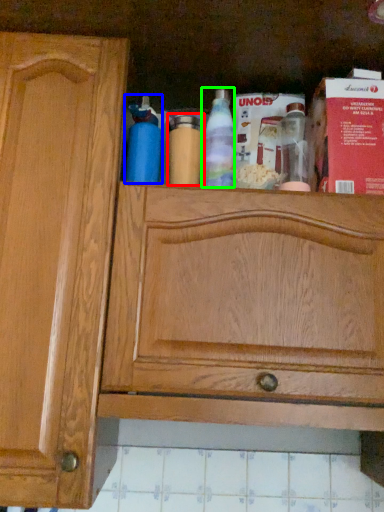
Question: Considering the real-world distances, which object is closest to bottle (highlighted by a red box)? bottle (highlighted by a blue box) or bottle (highlighted by a green box).

Choices:
 (A) bottle
 (B) bottle

Answer: (B)